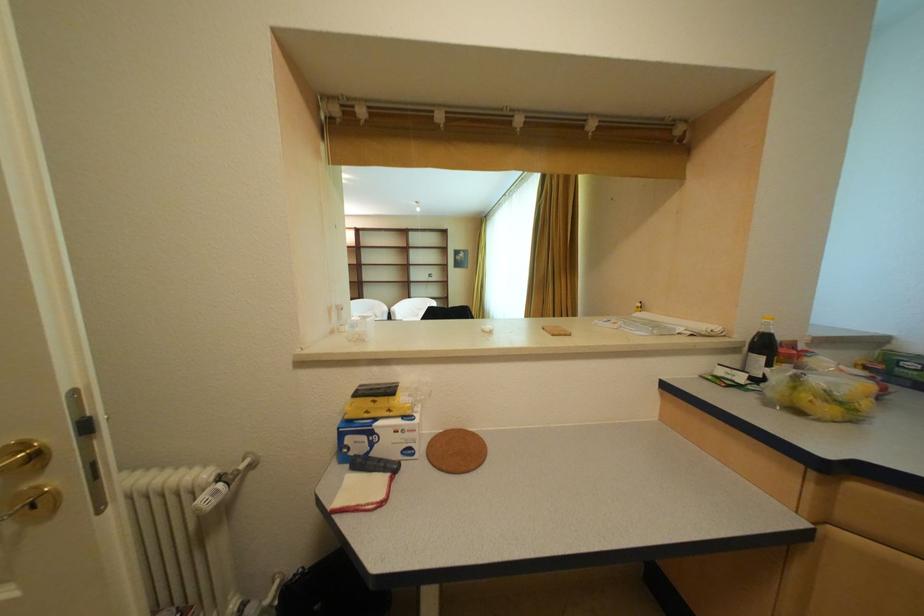
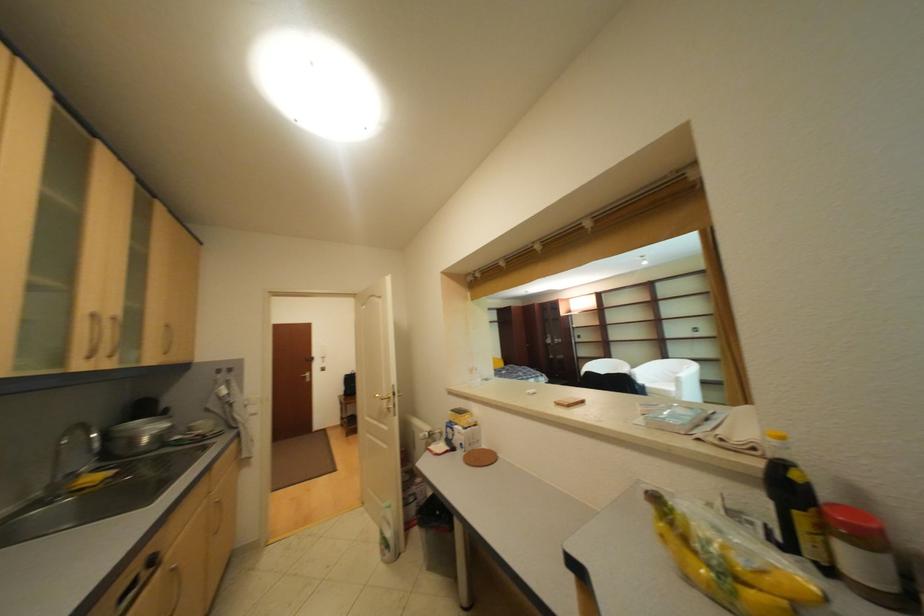
Where in the second image is the point corresponding to (869,411) from the first image?

(747, 596)